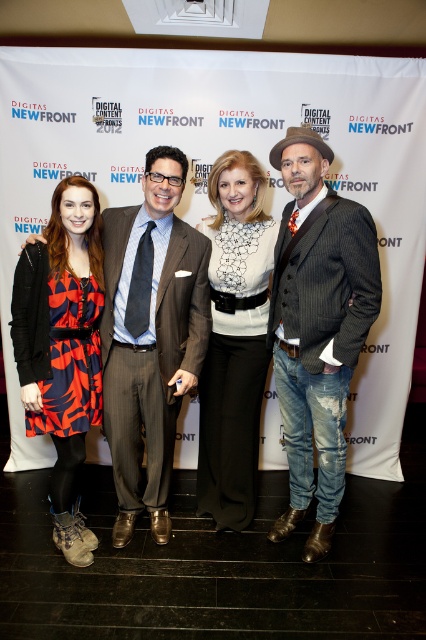
You are a photographer at the event and need to adjust the lighting to ensure both the matte black suit at center and the gray pinstripe suit at center are visible. Which suit should you focus the light on to make sure it stands out more?

The matte black suit at center is positioned over gray pinstripe suit at center, so focusing the light on the matte black suit at center would make it stand out more as it is in a forward position.